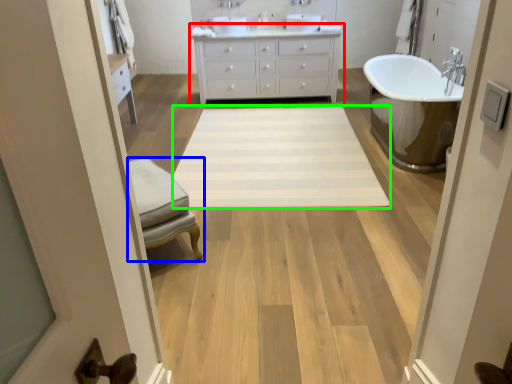
Question: Based on their relative distances, which object is farther from bathroom cabinet (highlighted by a red box)? Choose from furniture (highlighted by a blue box) and plain (highlighted by a green box).

Choices:
 (A) furniture
 (B) plain

Answer: (A)